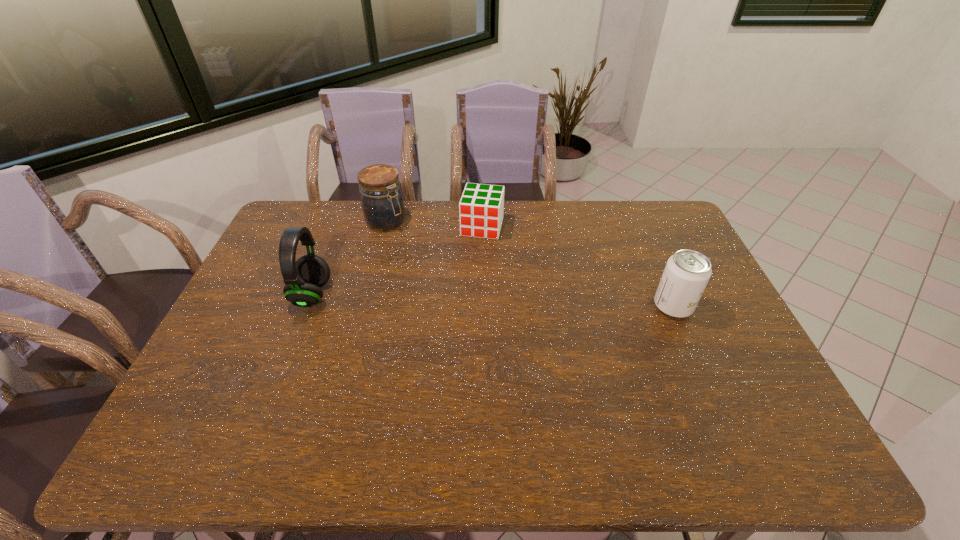
Locate an element on the screen. vacant space located on the lid of the jar is located at coordinates (460, 276).

Identify the location of vacant space situated 0.330m on the red face of the second object from right to left. (460, 308).

You are a GUI agent. You are given a task and a screenshot of the screen. Output one action in this format:
    pyautogui.click(x=<x>, y=<y>)
    Task: Click on the vacant space positioned on the red face of the second object from right to left
    
    Given the screenshot: What is the action you would take?
    pyautogui.click(x=466, y=287)

I want to click on vacant position located 0.180m on the red face of the second object from right to left, so click(x=469, y=274).

Where is `jar that is at the far edge`? The image size is (960, 540). jar that is at the far edge is located at coordinates (382, 202).

Where is `cube at the far edge`? cube at the far edge is located at coordinates (481, 207).

The width and height of the screenshot is (960, 540). Find the location of `object situated at the left edge`. object situated at the left edge is located at coordinates point(303,278).

At what (x,y) coordinates should I click in order to perform the action: click on object located at the right edge. Please return your answer as a coordinate pair (x, y). Looking at the image, I should click on (687, 272).

This screenshot has width=960, height=540. In order to click on blank area at the far edge in this screenshot , I will do `click(550, 220)`.

Locate an element on the screen. free space at the near edge of the desktop is located at coordinates [x=501, y=387].